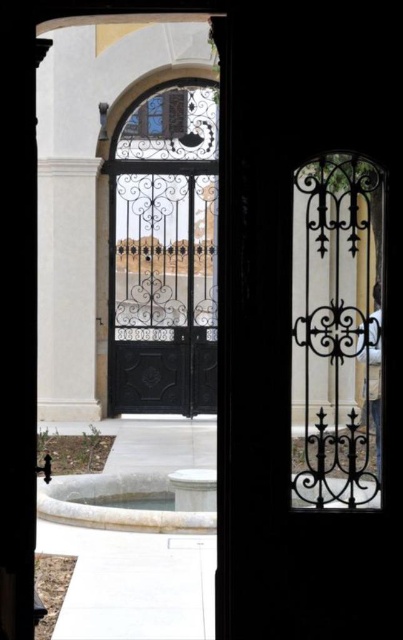
Is the position of black wrought iron gate at center less distant than that of white marble fountain at lower center?

No, it is not.

Is black wrought iron gate at center positioned at the back of white marble fountain at lower center?

Yes.

What do you see at coordinates (162, 288) in the screenshot?
I see `black wrought iron gate at center` at bounding box center [162, 288].

The height and width of the screenshot is (640, 403). I want to click on black wrought iron gate at center, so click(x=162, y=288).